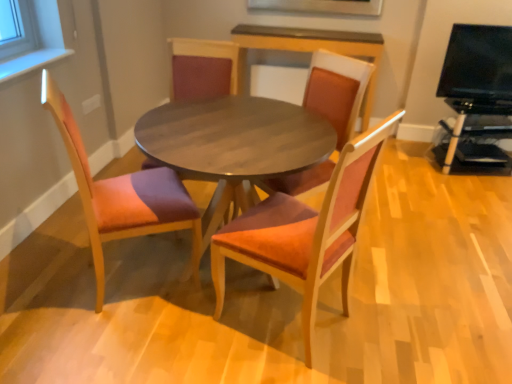
Question: From a real-world perspective, relative to matte wood chair at center, the 2th chair in the right-to-left sequence, is suede-like orange chair at center, the first chair viewed from the right, vertically above or below?

Choices:
 (A) above
 (B) below

Answer: (A)

Question: From the image's perspective, is suede-like orange chair at center, the first chair viewed from the right, above or below matte wood chair at center, the 2th chair in the right-to-left sequence?

Choices:
 (A) above
 (B) below

Answer: (A)

Question: Estimate the real-world distances between objects in this image. Which object is farther from the black plastic entertainment center at right, which appears as the second entertainment center when viewed from the top?

Choices:
 (A) orange fabric chair at left, the fourth chair viewed from the right
 (B) suede-like orange chair at center, acting as the 4th chair starting from the left
 (C) wooden table at center
 (D) matte wood chair at center, which is the 2th chair from left to right
 (E) wooden round table at center

Answer: (A)

Question: Which object is positioned closest to the black glossy tv at upper right, which appears as the 1th entertainment center when viewed from the top?

Choices:
 (A) orange fabric chair at left, the fourth chair viewed from the right
 (B) wooden table at center
 (C) wooden round table at center
 (D) matte wood chair at center, which appears as the 3th chair when viewed from the left
 (E) black plastic entertainment center at right, which appears as the second entertainment center when viewed from the top

Answer: (E)